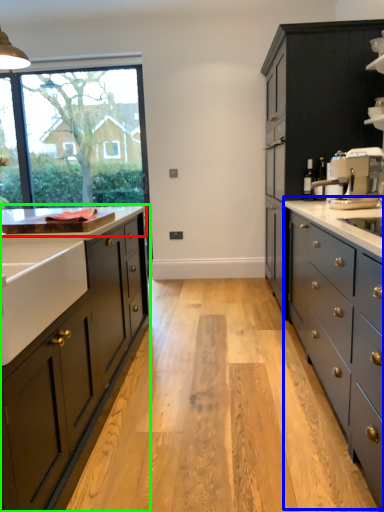
Question: Considering the real-world distances, which object is farthest from countertop (highlighted by a red box)? counter (highlighted by a blue box) or cabinetry (highlighted by a green box)?

Choices:
 (A) counter
 (B) cabinetry

Answer: (A)